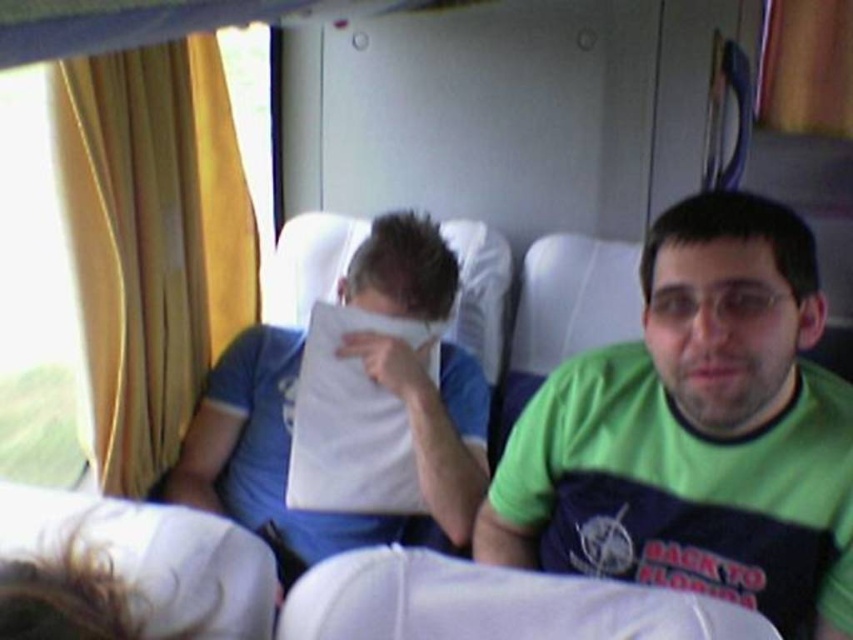
You are a delivery robot in a vehicle. You need to place a small package on the white paper at center without disturbing the green jersey at center. Is the space between them sufficient for you to carefully maneuver the package?

The distance between the green jersey at center and the white paper at center is 19.14 inches, which should provide enough space for the delivery robot to carefully maneuver the package without disturbing either item.

You are a passenger on a train and you see the green jersey at center and the white paper at center. Which object is closer to you?

The green jersey at center is positioned under the white paper at center, so the white paper at center is closer to you.